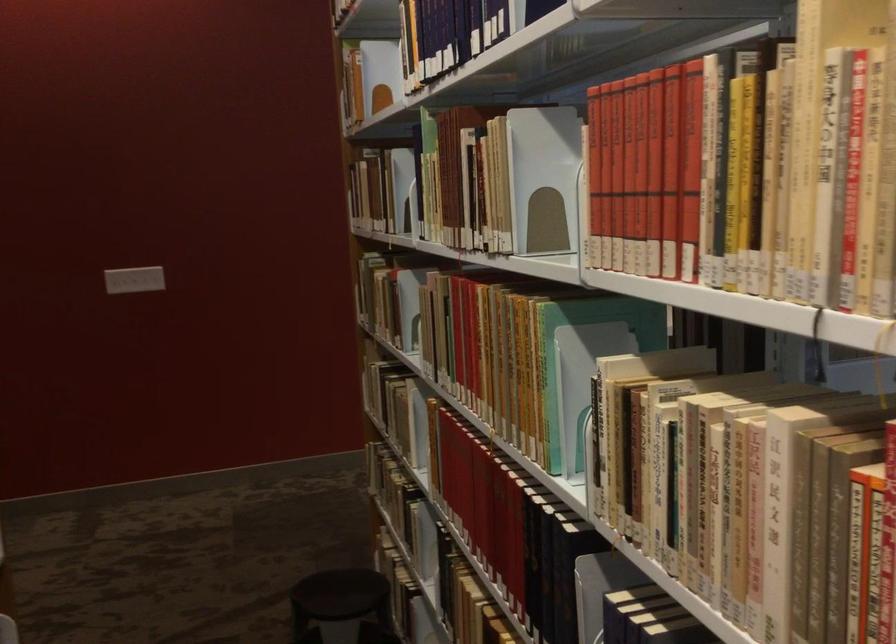
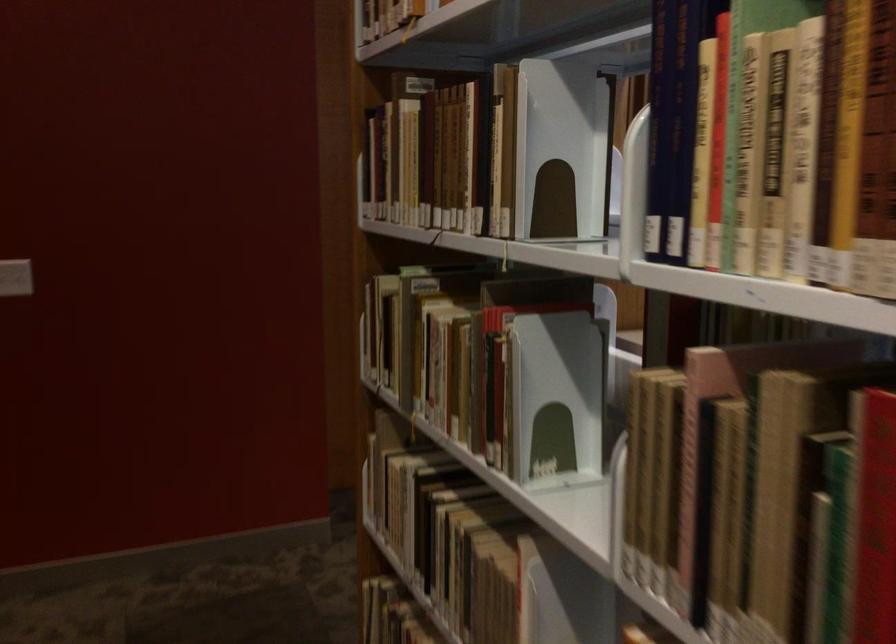
Find the pixel in the second image that matches pixel 421 308 in the first image.

(556, 398)